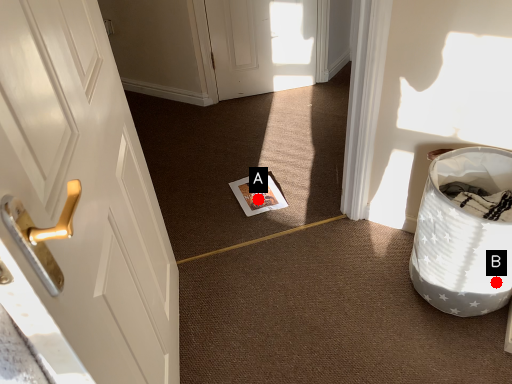
Question: Two points are circled on the image, labeled by A and B beside each circle. Which of the following is the farthest from the observer?

Choices:
 (A) A is further
 (B) B is further

Answer: (A)